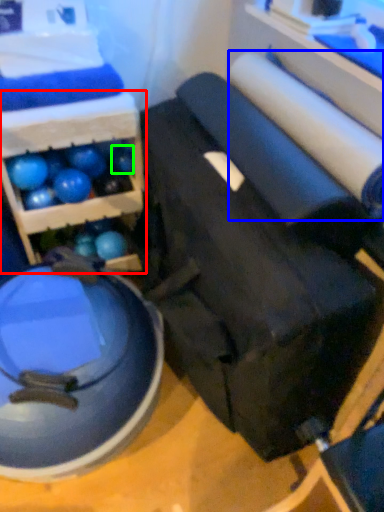
Question: Considering the real-world distances, which object is farthest from shelf (highlighted by a red box)? toilet paper (highlighted by a blue box) or ball (highlighted by a green box)?

Choices:
 (A) toilet paper
 (B) ball

Answer: (A)